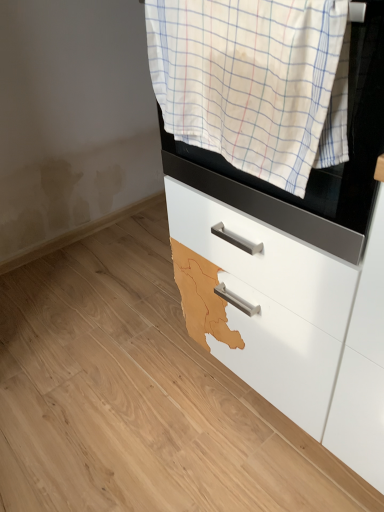
This screenshot has height=512, width=384. What do you see at coordinates (254, 81) in the screenshot?
I see `white checkered towel at upper center` at bounding box center [254, 81].

This screenshot has width=384, height=512. I want to click on white checkered towel at upper center, so click(x=254, y=81).

The height and width of the screenshot is (512, 384). Describe the element at coordinates (291, 322) in the screenshot. I see `white glossy drawer at center` at that location.

Measure the distance between point [380,479] and camera.

The depth of point [380,479] is 3.38 feet.

This screenshot has height=512, width=384. Identify the location of white glossy drawer at center. (291, 322).

Identify the location of white checkered towel at upper center. (254, 81).

Between white checkered towel at upper center and white glossy drawer at center, which one appears on the right side from the viewer's perspective?

white glossy drawer at center is more to the right.

Is the position of white checkered towel at upper center more distant than that of white glossy drawer at center?

No.

Between point (176, 122) and point (298, 320), which one is positioned behind?

Positioned behind is point (298, 320).

From the image's perspective, who appears lower, white checkered towel at upper center or white glossy drawer at center?

white glossy drawer at center appears lower in the image.

From a real-world perspective, which is physically above, white checkered towel at upper center or white glossy drawer at center?

From a 3D spatial view, white checkered towel at upper center is above.

Is white checkered towel at upper center thinner than white glossy drawer at center?

Indeed, white checkered towel at upper center has a lesser width compared to white glossy drawer at center.

From their relative heights in the image, would you say white checkered towel at upper center is taller or shorter than white glossy drawer at center?

white checkered towel at upper center is shorter than white glossy drawer at center.

Looking at the image, does white checkered towel at upper center seem bigger or smaller compared to white glossy drawer at center?

white checkered towel at upper center is smaller than white glossy drawer at center.

Is white checkered towel at upper center located outside white glossy drawer at center?

Yes, white checkered towel at upper center is outside of white glossy drawer at center.

Can you see white checkered towel at upper center touching white glossy drawer at center?

No, white checkered towel at upper center is not touching white glossy drawer at center.

Is white checkered towel at upper center oriented away from white glossy drawer at center?

No, white checkered towel at upper center's orientation is not away from white glossy drawer at center.

Measure the distance between white checkered towel at upper center and white glossy drawer at center.

white checkered towel at upper center is 13.57 inches away from white glossy drawer at center.

Identify the location of clothing above the white glossy drawer at center (from the image's perspective). The width and height of the screenshot is (384, 512). (254, 81).

In the scene shown: Visually, is white glossy drawer at center positioned to the left or to the right of white checkered towel at upper center?

white glossy drawer at center is positioned on white checkered towel at upper center's right side.

Considering the positions of objects white glossy drawer at center and white checkered towel at upper center in the image provided, who is in front, white glossy drawer at center or white checkered towel at upper center?

white checkered towel at upper center is closer to the camera.

Considering the positions of point (258, 292) and point (297, 78), is point (258, 292) closer or farther from the camera than point (297, 78)?

Clearly, point (258, 292) is more distant from the camera than point (297, 78).

Based on the photo, from the image's perspective, between white glossy drawer at center and white checkered towel at upper center, who is located below?

white glossy drawer at center.

From a real-world perspective, is white glossy drawer at center above or below white checkered towel at upper center?

Clearly, from a real-world perspective, white glossy drawer at center is below white checkered towel at upper center.

Considering the relative sizes of white glossy drawer at center and white checkered towel at upper center in the image provided, is white glossy drawer at center thinner than white checkered towel at upper center?

No, white glossy drawer at center is not thinner than white checkered towel at upper center.

Considering the sizes of objects white glossy drawer at center and white checkered towel at upper center in the image provided, who is taller, white glossy drawer at center or white checkered towel at upper center?

With more height is white glossy drawer at center.

Considering the sizes of objects white glossy drawer at center and white checkered towel at upper center in the image provided, who is bigger, white glossy drawer at center or white checkered towel at upper center?

white glossy drawer at center.

From the picture: Is white glossy drawer at center not inside white checkered towel at upper center?

white glossy drawer at center lies outside white checkered towel at upper center's area.

Is white glossy drawer at center with white checkered towel at upper center?

No, white glossy drawer at center is not in contact with white checkered towel at upper center.

Is white glossy drawer at center aimed at white checkered towel at upper center?

No, white glossy drawer at center is not oriented towards white checkered towel at upper center.

Where is `clothing that is above the white glossy drawer at center (from a real-world perspective)`? The width and height of the screenshot is (384, 512). clothing that is above the white glossy drawer at center (from a real-world perspective) is located at coordinates (254, 81).

Locate an element on the screen. chest of drawers behind the white checkered towel at upper center is located at coordinates (291, 322).

At what (x,y) coordinates should I click in order to perform the action: click on chest of drawers below the white checkered towel at upper center (from the image's perspective). Please return your answer as a coordinate pair (x, y). Image resolution: width=384 pixels, height=512 pixels. Looking at the image, I should click on tap(291, 322).